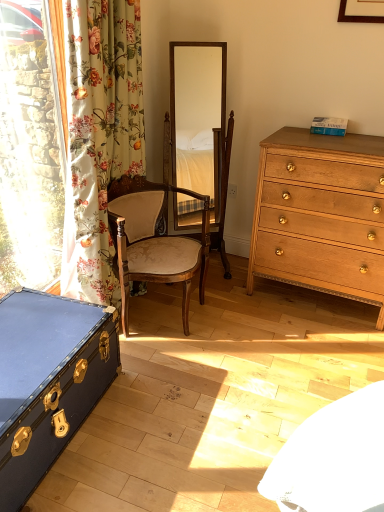
Find the location of `vacant area located to the right-hand side of wooden chair at center`. vacant area located to the right-hand side of wooden chair at center is located at coordinates (248, 320).